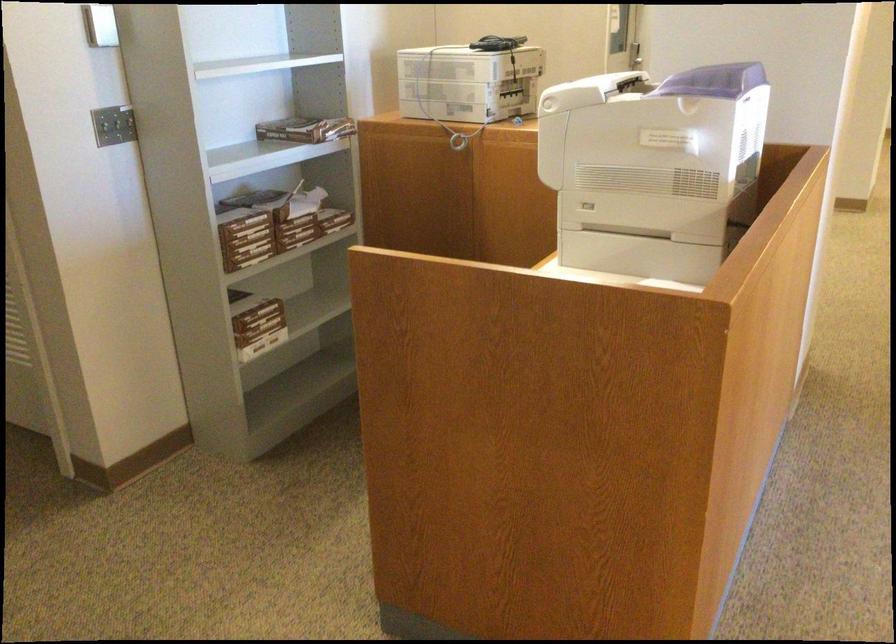
Locate an element on the screen. This screenshot has height=644, width=896. printer scanner lid is located at coordinates (714, 80).